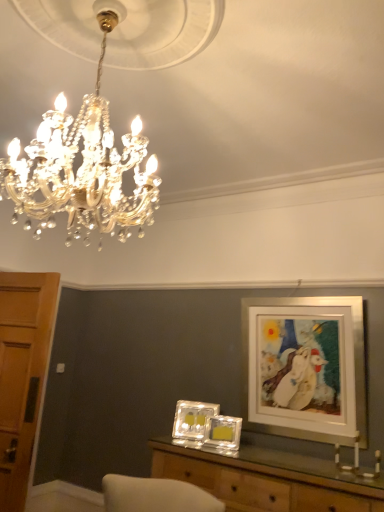
Question: In the image, is gold crystal chandelier at upper center positioned in front of or behind wooden door at left?

Choices:
 (A) behind
 (B) front

Answer: (B)

Question: Does point (16, 142) appear closer or farther from the camera than point (44, 274)?

Choices:
 (A) farther
 (B) closer

Answer: (B)

Question: Based on their relative distances, which object is farther from the wooden door at left?

Choices:
 (A) wooden table at center
 (B) gold crystal chandelier at upper center
 (C) white matte picture frame at upper right, the first picture frame from the right
 (D) translucent glass picture frame at center, the 2th picture frame viewed from the left
 (E) clear glass picture frame at center, arranged as the third picture frame when viewed from the right

Answer: (C)

Question: Estimate the real-world distances between objects in this image. Which object is farther from the clear glass picture frame at center, the 1th picture frame positioned from the left?

Choices:
 (A) gold crystal chandelier at upper center
 (B) wooden door at left
 (C) white matte picture frame at upper right, the first picture frame from the right
 (D) wooden table at center
 (E) translucent glass picture frame at center, which appears as the 2th picture frame when viewed from the right

Answer: (A)